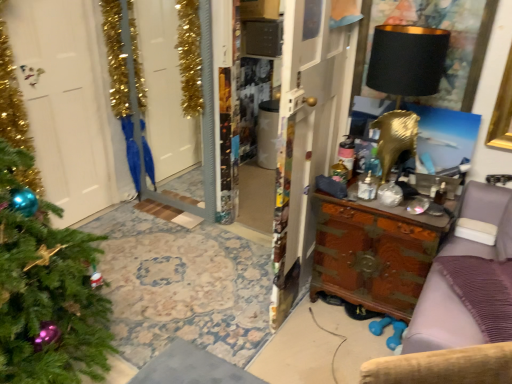
Question: Looking at their shapes, would you say wooden chest at right is wider or thinner than gold metallic screen door at upper left?

Choices:
 (A) thin
 (B) wide

Answer: (B)

Question: Does point (404, 223) appear closer or farther from the camera than point (202, 18)?

Choices:
 (A) closer
 (B) farther

Answer: (A)

Question: Considering the real-world distances, which object is farthest from the black matte lampshade at upper right?

Choices:
 (A) green matte christmas tree at left
 (B) wooden chest of drawers at right
 (C) wooden chest at center
 (D) black fabric picture frame at upper right
 (E) wooden chest at right

Answer: (A)

Question: Which object is the farthest from the black fabric picture frame at upper right?

Choices:
 (A) black matte lampshade at upper right
 (B) green matte christmas tree at left
 (C) gold metallic screen door at upper left
 (D) wooden chest of drawers at right
 (E) wooden chest at right

Answer: (B)